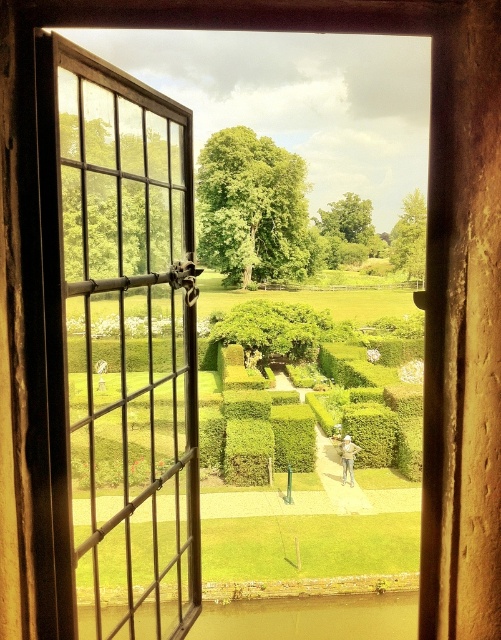
Describe the element at coordinates (128, 348) in the screenshot. I see `black metal window at left` at that location.

Can you confirm if black metal window at left is taller than smooth stone statue at center?

Indeed, black metal window at left has a greater height compared to smooth stone statue at center.

Is point (185, 483) in front of point (355, 452)?

Yes, it is in front of point (355, 452).

This screenshot has height=640, width=501. Identify the location of black metal window at left. (128, 348).